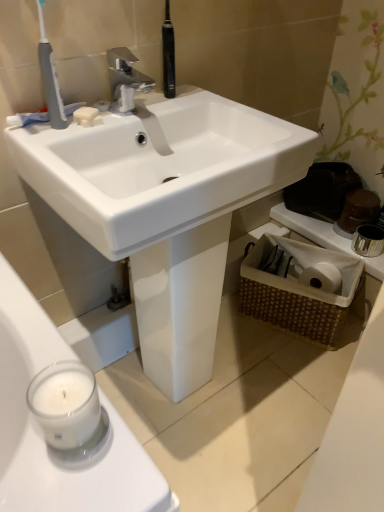
Where is `spots to the right of white matte toothpaste at upper left`? The width and height of the screenshot is (384, 512). spots to the right of white matte toothpaste at upper left is located at coordinates (122, 114).